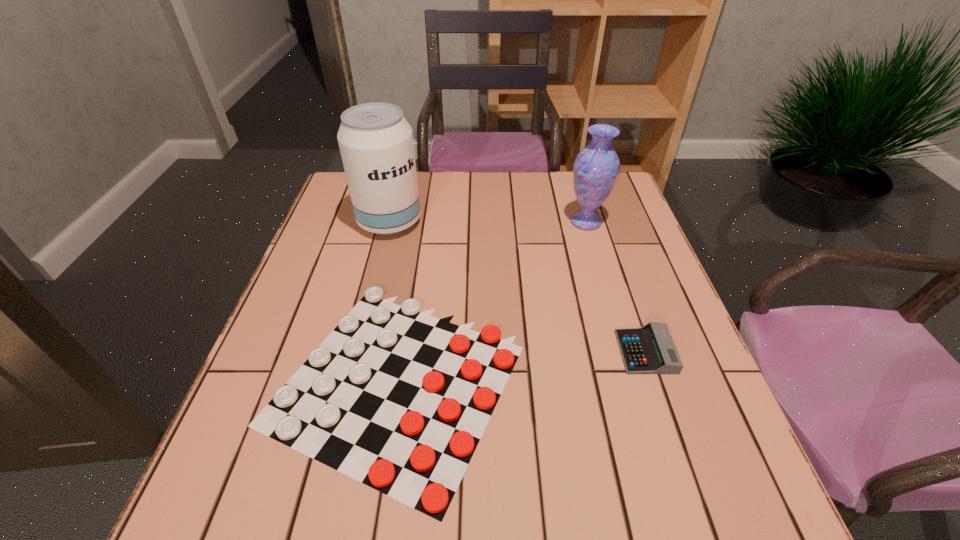
The image size is (960, 540). I want to click on alcohol, so click(x=375, y=140).

Where is `the second tallest object`? the second tallest object is located at coordinates (595, 170).

You are a GUI agent. You are given a task and a screenshot of the screen. Output one action in this format:
    pyautogui.click(x=<x>, y=<y>)
    Task: Click on the calculator
    This screenshot has height=540, width=960.
    Given the screenshot: What is the action you would take?
    pyautogui.click(x=650, y=349)

Identify the location of the shortest object. This screenshot has height=540, width=960. (394, 398).

This screenshot has height=540, width=960. What are the coordinates of `vacant space positioned 0.390m on the right of the alcohol` in the screenshot? It's located at (559, 222).

Locate an element on the screen. The height and width of the screenshot is (540, 960). vacant region located 0.110m on the left of the second tallest object is located at coordinates (526, 222).

Locate an element on the screen. The image size is (960, 540). free space located on the left of the third tallest object is located at coordinates (432, 352).

This screenshot has width=960, height=540. What are the coordinates of `vacant position located on the back of the shortest object` in the screenshot? It's located at (422, 230).

Identify the location of alcohol present at the far edge. This screenshot has width=960, height=540. (375, 140).

Where is `vase present at the far edge`? vase present at the far edge is located at coordinates (595, 170).